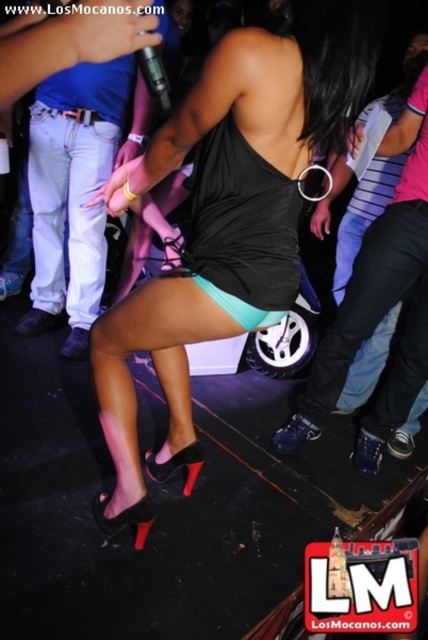
Question: Does black leather pants at lower right lie in front of jeans at left?

Choices:
 (A) no
 (B) yes

Answer: (B)

Question: Which point is closer to the camera?

Choices:
 (A) (76, 292)
 (B) (374, 435)
 (C) (178, 132)

Answer: (C)

Question: In this image, where is matte black dress at center located relative to jeans at left?

Choices:
 (A) below
 (B) above

Answer: (A)

Question: Which point is farther to the camera?

Choices:
 (A) 74,157
 (B) 275,256

Answer: (A)

Question: Which of these objects is positioned closest to the matte black dress at center?

Choices:
 (A) jeans at left
 (B) black leather pants at lower right

Answer: (B)

Question: In this image, where is matte black dress at center located relative to jeans at left?

Choices:
 (A) left
 (B) right

Answer: (B)